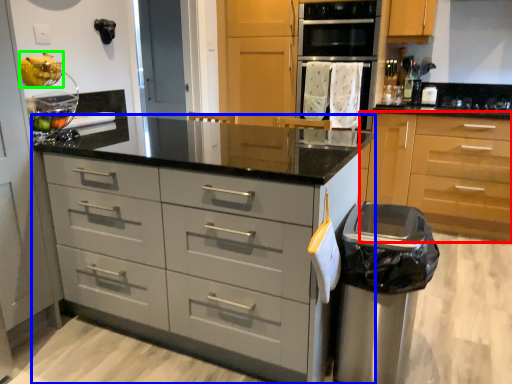
Question: Which object is positioned farthest from cabinetry (highlighted by a red box)? Select from chest of drawers (highlighted by a blue box) and fruit (highlighted by a green box).

Choices:
 (A) chest of drawers
 (B) fruit

Answer: (B)